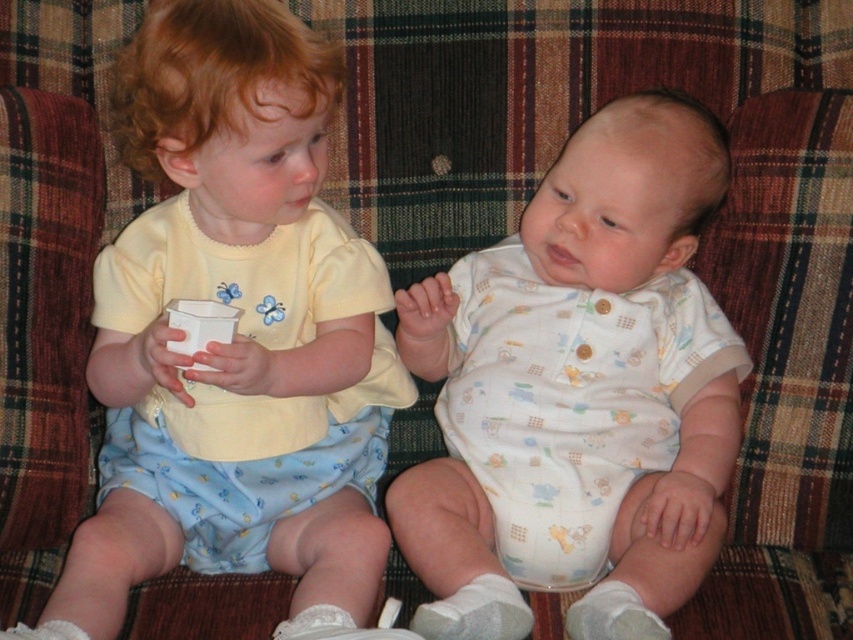
The height and width of the screenshot is (640, 853). I want to click on yellow cotton shirt at left, so click(x=234, y=336).

Between point (271, 330) and point (531, 564), which one is positioned in front?

Point (531, 564) is in front.

Is point (189, 54) positioned in front of point (549, 524)?

Yes, point (189, 54) is in front of point (549, 524).

Identify the location of yellow cotton shirt at left. (234, 336).